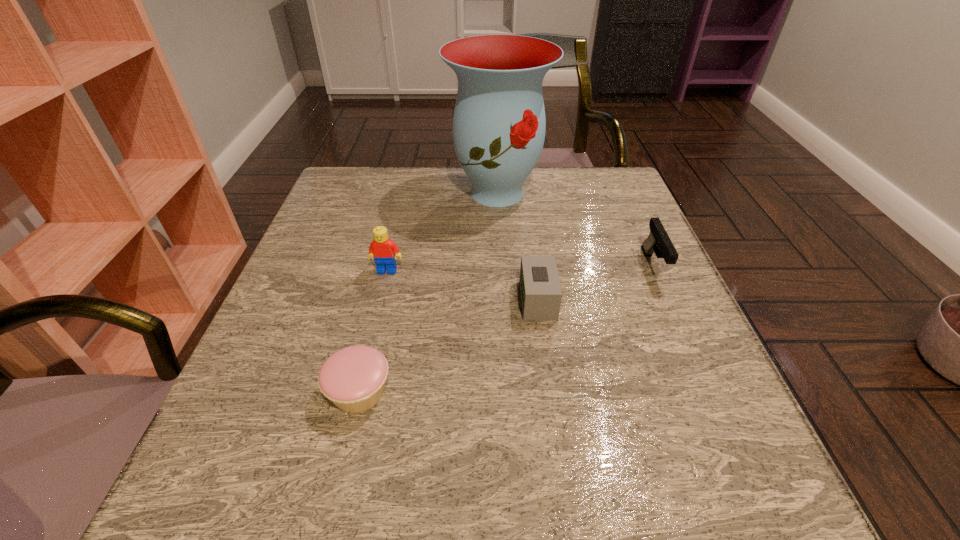
This screenshot has height=540, width=960. What are the coordinates of `blank space located 0.240m on the front-facing side of the alarm clock` in the screenshot? It's located at (397, 300).

This screenshot has width=960, height=540. What are the coordinates of `free space located on the front-facing side of the alarm clock` in the screenshot? It's located at (469, 300).

Locate an element on the screen. The width and height of the screenshot is (960, 540). free space located on the front-facing side of the alarm clock is located at coordinates (341, 300).

The image size is (960, 540). I want to click on vacant region located 0.220m on the back of the nearest object, so click(x=386, y=278).

Identify the location of object situated at the far edge. (499, 124).

I want to click on object present at the left edge, so click(x=353, y=378).

This screenshot has height=540, width=960. In order to click on object at the right edge in this screenshot , I will do `click(658, 242)`.

Locate an element on the screen. The height and width of the screenshot is (540, 960). free space at the far edge of the desktop is located at coordinates (536, 200).

In the image, there is a desktop. At what (x,y) coordinates should I click in order to perform the action: click on blank space at the near edge. Please return your answer as a coordinate pair (x, y). Looking at the image, I should click on (380, 477).

In the image, there is a desktop. In order to click on vacant space at the left edge in this screenshot , I will do `click(321, 329)`.